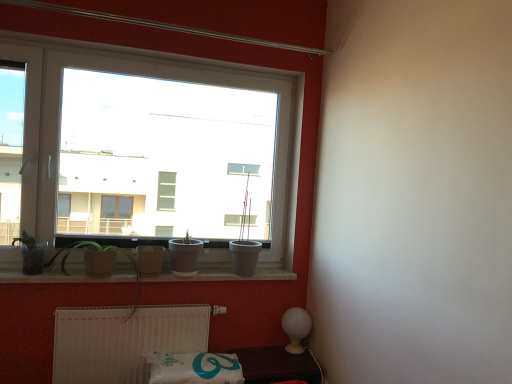
Question: Is white concrete window sill at lower center taller or shorter than matte gray pot at center?

Choices:
 (A) short
 (B) tall

Answer: (A)

Question: Is point (176, 279) positioned closer to the camera than point (175, 264)?

Choices:
 (A) farther
 (B) closer

Answer: (A)

Question: Estimate the real-world distances between objects in this image. Which object is closer to the white plastic window at upper left?

Choices:
 (A) matte gray pot at center
 (B) green matte plant at lower left, the 1th plant positioned from the right
 (C) matte glass pot at left, the first plant positioned from the left
 (D) white plastic radiator at lower center
 (E) white concrete window sill at lower center

Answer: (E)

Question: Which object is the closest to the white plastic radiator at lower center?

Choices:
 (A) white concrete window sill at lower center
 (B) green matte plant at lower left, the 1th plant positioned from the right
 (C) white plastic window at upper left
 (D) white glossy lamp at lower right
 (E) matte glass pot at left, the first plant positioned from the left

Answer: (B)